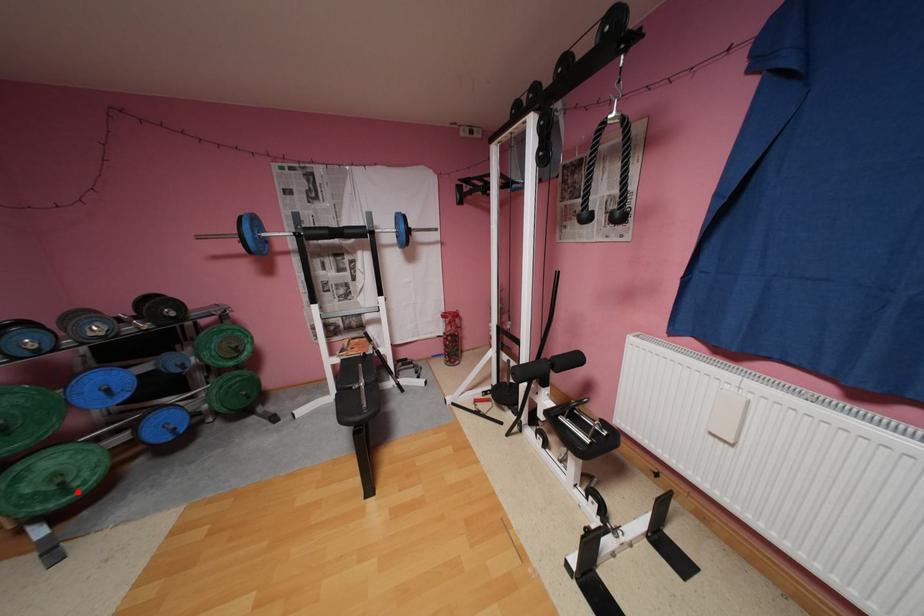
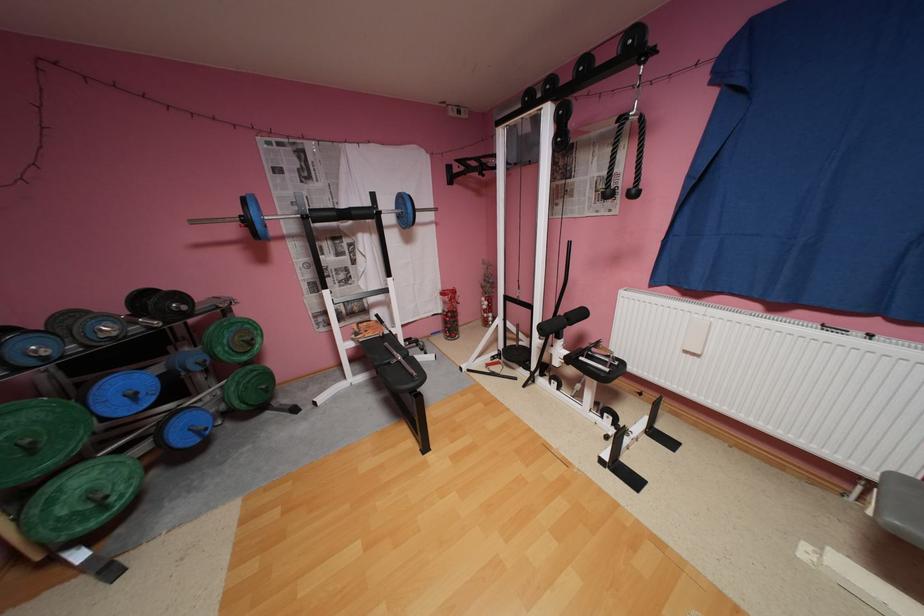
Question: I am providing you with two images of the same scene from different viewpoints. A red point is shown in image1. For the corresponding object point in image2, is it positioned nearer or farther from the camera?

Choices:
 (A) Nearer
 (B) Farther

Answer: (A)